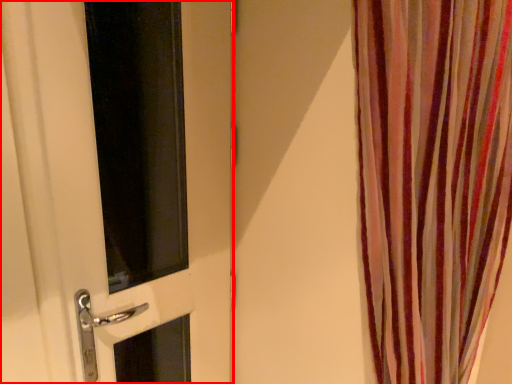
Question: From the image, what is the correct spatial relationship of door (annotated by the red box) in relation to curtain?

Choices:
 (A) right
 (B) left

Answer: (B)